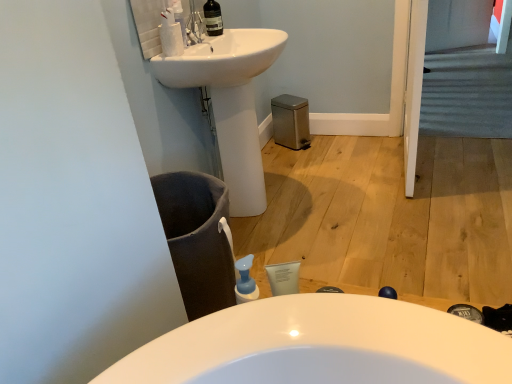
Question: Is white glossy sink at upper center thinner than transparent glass bottle at upper center?

Choices:
 (A) yes
 (B) no

Answer: (B)

Question: Is white glossy sink at upper center further to camera compared to transparent glass bottle at upper center?

Choices:
 (A) no
 (B) yes

Answer: (A)

Question: From the image's perspective, is white glossy sink at upper center beneath transparent glass bottle at upper center?

Choices:
 (A) yes
 (B) no

Answer: (A)

Question: Considering the relative sizes of white glossy sink at upper center and transparent glass bottle at upper center in the image provided, is white glossy sink at upper center shorter than transparent glass bottle at upper center?

Choices:
 (A) no
 (B) yes

Answer: (A)

Question: From a real-world perspective, is white glossy sink at upper center located higher than transparent glass bottle at upper center?

Choices:
 (A) yes
 (B) no

Answer: (B)

Question: Visually, is white matte cleaning product at upper left positioned to the left or to the right of carpeted stairs at upper right?

Choices:
 (A) left
 (B) right

Answer: (A)

Question: Does point (160, 43) appear closer or farther from the camera than point (440, 61)?

Choices:
 (A) farther
 (B) closer

Answer: (B)

Question: Do you think white matte cleaning product at upper left is within carpeted stairs at upper right, or outside of it?

Choices:
 (A) inside
 (B) outside

Answer: (B)

Question: Considering the positions of white matte cleaning product at upper left and carpeted stairs at upper right in the image, is white matte cleaning product at upper left bigger or smaller than carpeted stairs at upper right?

Choices:
 (A) big
 (B) small

Answer: (B)

Question: Considering their positions, is white glossy soap dispenser at upper center located in front of or behind white glossy sink at upper center?

Choices:
 (A) front
 (B) behind

Answer: (B)

Question: Is white glossy soap dispenser at upper center wider or thinner than white glossy sink at upper center?

Choices:
 (A) thin
 (B) wide

Answer: (A)

Question: From a real-world perspective, is white glossy soap dispenser at upper center positioned above or below white glossy sink at upper center?

Choices:
 (A) above
 (B) below

Answer: (A)

Question: From the image's perspective, is white glossy soap dispenser at upper center located above or below white glossy sink at upper center?

Choices:
 (A) below
 (B) above

Answer: (B)

Question: Does point (204, 16) appear closer or farther from the camera than point (175, 16)?

Choices:
 (A) farther
 (B) closer

Answer: (A)

Question: Considering the positions of transparent glass bottle at upper center and white glossy soap dispenser at upper center in the image, is transparent glass bottle at upper center taller or shorter than white glossy soap dispenser at upper center?

Choices:
 (A) short
 (B) tall

Answer: (B)